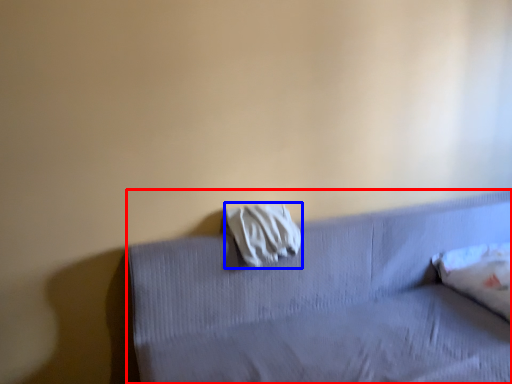
Question: Which object is closer to the camera taking this photo, furniture (highlighted by a red box) or material (highlighted by a blue box)?

Choices:
 (A) furniture
 (B) material

Answer: (A)